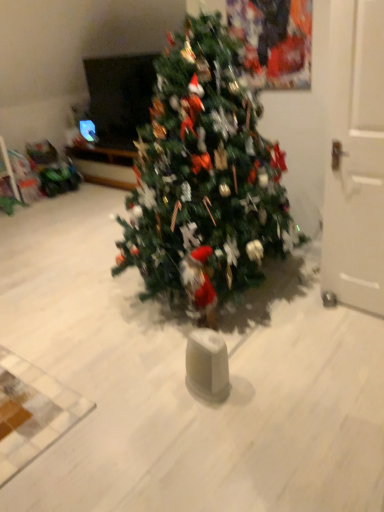
Question: From the image's perspective, is white matte door at right above or below green matte christmas tree at center?

Choices:
 (A) below
 (B) above

Answer: (A)

Question: Looking at their shapes, would you say white matte door at right is wider or thinner than green matte christmas tree at center?

Choices:
 (A) wide
 (B) thin

Answer: (B)

Question: Would you say white matte door at right is to the left or to the right of green matte christmas tree at center in the picture?

Choices:
 (A) right
 (B) left

Answer: (A)

Question: Considering their positions, is green matte christmas tree at center located in front of or behind white matte door at right?

Choices:
 (A) behind
 (B) front

Answer: (B)

Question: Looking at their shapes, would you say green matte christmas tree at center is wider or thinner than white matte door at right?

Choices:
 (A) thin
 (B) wide

Answer: (B)

Question: Would you say green matte christmas tree at center is inside or outside white matte door at right?

Choices:
 (A) outside
 (B) inside

Answer: (A)

Question: Considering the positions of green matte christmas tree at center and white matte door at right in the image, is green matte christmas tree at center taller or shorter than white matte door at right?

Choices:
 (A) tall
 (B) short

Answer: (A)